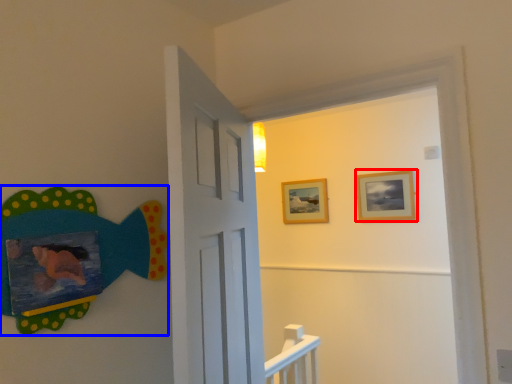
Question: Which point is closer to the camera, picture frame (highlighted by a red box) or art (highlighted by a blue box)?

Choices:
 (A) picture frame
 (B) art

Answer: (B)